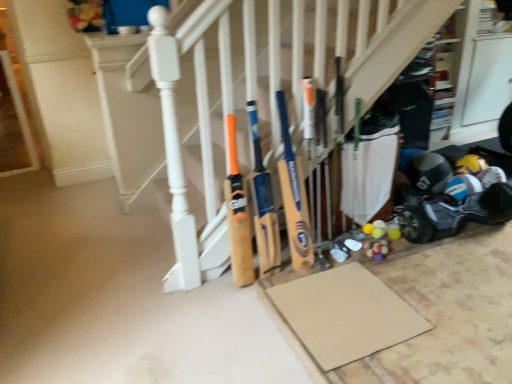
Question: From the image's perspective, is yellow wood bat at center, which is the 1th baseball bat from right to left, located above or below wooden bat at center, the second baseball bat positioned from the right?

Choices:
 (A) above
 (B) below

Answer: (A)

Question: Which is correct: yellow wood bat at center, which is the 1th baseball bat from right to left, is inside wooden bat at center, the 1th baseball bat from the left, or outside of it?

Choices:
 (A) inside
 (B) outside

Answer: (B)

Question: Considering the real-world distances, which object is farthest from the yellow wood bat at center, which is the 1th baseball bat from right to left?

Choices:
 (A) wooden bat at center, the 1th baseball bat from the left
 (B) wooden bats at center
 (C) matte black helmet at lower right
 (D) blue plastic baby carriage at lower right

Answer: (C)

Question: Which is nearer to the wooden bats at center?

Choices:
 (A) blue plastic baby carriage at lower right
 (B) yellow wood bat at center, which is the 1th baseball bat from right to left
 (C) matte black helmet at lower right
 (D) wooden bat at center, the second baseball bat positioned from the right

Answer: (B)